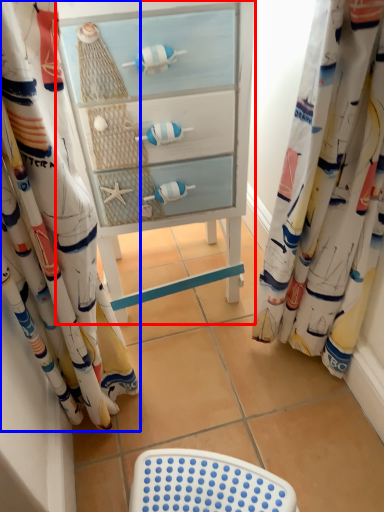
Question: Among these objects, which one is nearest to the camera, furniture (highlighted by a red box) or curtain (highlighted by a blue box)?

Choices:
 (A) furniture
 (B) curtain

Answer: (B)